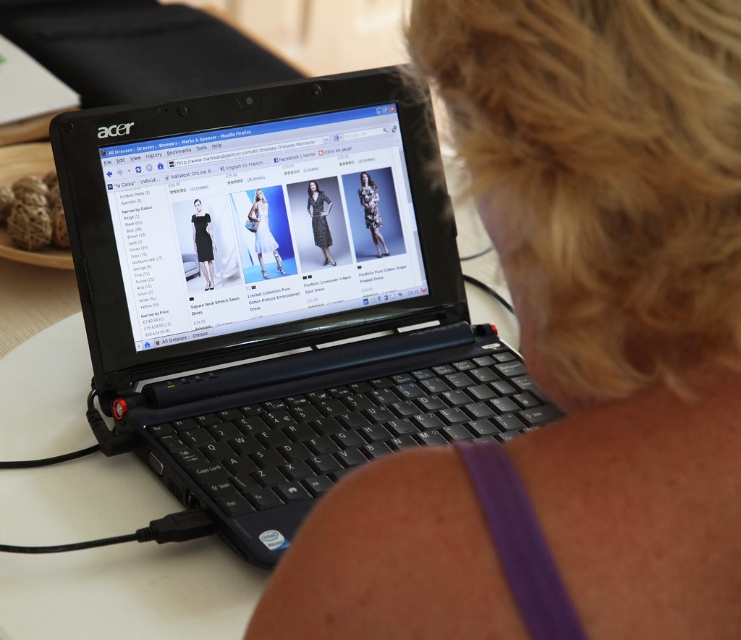
You are a fashion designer looking at the laptop screen showing the All Dresses page. You notice two dresses displayed at the center of the screen. Which dress is taller, the matte black dress at center or the black satin dress at center?

The matte black dress at center is much taller than the black satin dress at center.

You are trying to reach for the floral fabric dress at center while keeping your hand on the matte black laptop at center. Which object will your hand touch first?

Your hand will first touch the matte black laptop at center because it is closer to you than the floral fabric dress at center.